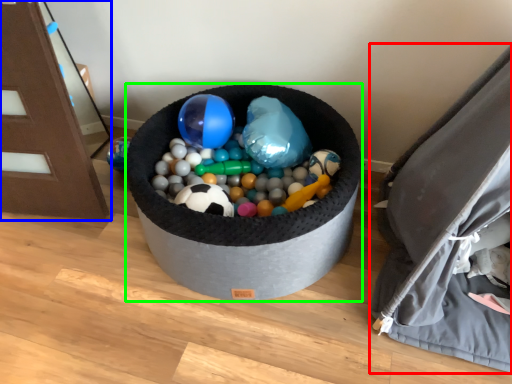
Question: Based on their relative distances, which object is farther from bean bag chair (highlighted by a red box)? Choose from furniture (highlighted by a blue box) and toy (highlighted by a green box).

Choices:
 (A) furniture
 (B) toy

Answer: (A)